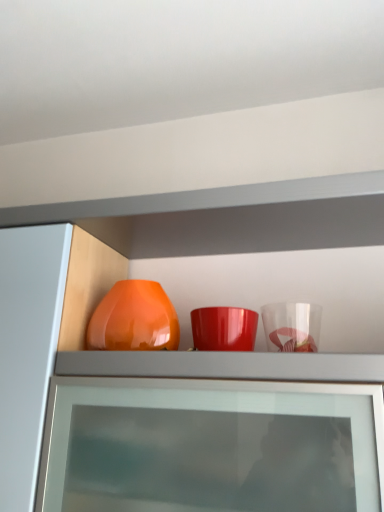
Question: Is glossy orange vase at center taller or shorter than matte orange vase at center?

Choices:
 (A) tall
 (B) short

Answer: (B)

Question: Is point [x=119, y=345] closer or farther from the camera than point [x=92, y=225]?

Choices:
 (A) farther
 (B) closer

Answer: (B)

Question: Considering their positions, is glossy orange vase at center located in front of or behind matte orange vase at center?

Choices:
 (A) behind
 (B) front

Answer: (A)

Question: Considering the relative positions of matte orange vase at center and glossy orange vase at center in the image provided, is matte orange vase at center to the left or to the right of glossy orange vase at center?

Choices:
 (A) right
 (B) left

Answer: (A)

Question: Does point (54, 216) appear closer or farther from the camera than point (99, 327)?

Choices:
 (A) farther
 (B) closer

Answer: (B)

Question: Do you think matte orange vase at center is within glossy orange vase at center, or outside of it?

Choices:
 (A) inside
 (B) outside

Answer: (B)

Question: Is matte orange vase at center bigger or smaller than glossy orange vase at center?

Choices:
 (A) big
 (B) small

Answer: (A)